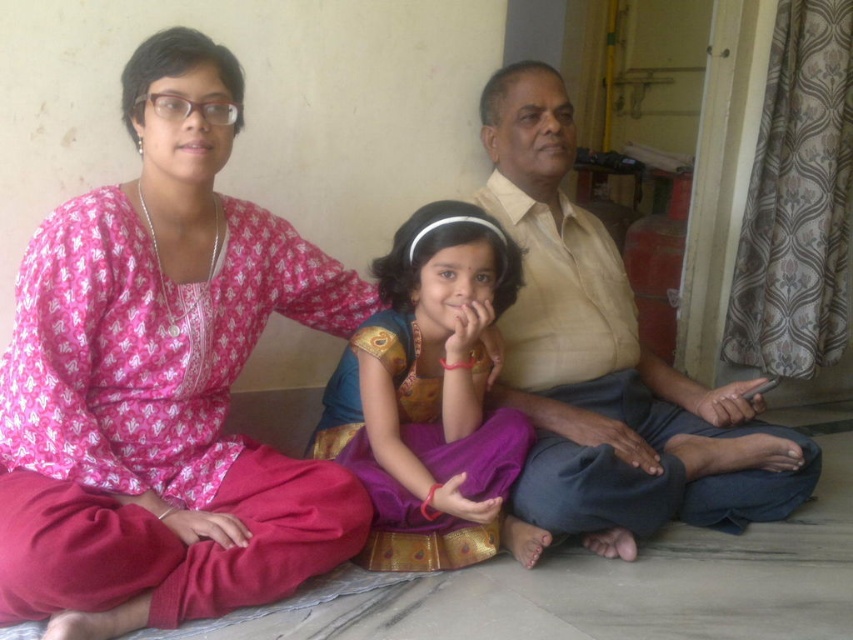
You are a photographer setting up for a family portrait. You want to ensure that the pink printed dress at left and the beige cotton shirt at center are both in focus. The camera you are using has a depth of field that can cover objects within a 25 inch range. Will both items be in focus?

The distance between the pink printed dress at left and the beige cotton shirt at center is 24.58 inches, which is within the camera sensor range of 25 inches. Therefore, both items will be in focus.

In the scene where three people are sitting together, you notice the beige cotton shirt at center and the purple satin saree at center. Which of these two items is taller?

The beige cotton shirt at center is much taller than the purple satin saree at center.